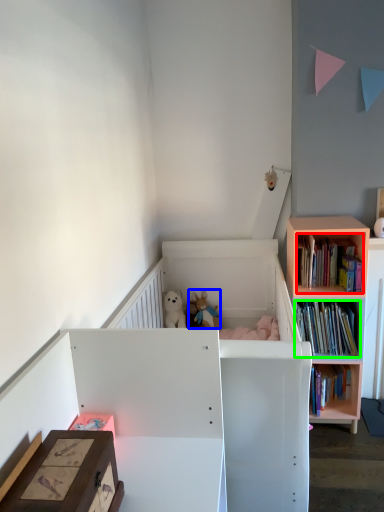
Question: Which object is positioned farthest from book (highlighted by a red box)? Select from toy (highlighted by a blue box) and book (highlighted by a green box).

Choices:
 (A) toy
 (B) book

Answer: (A)